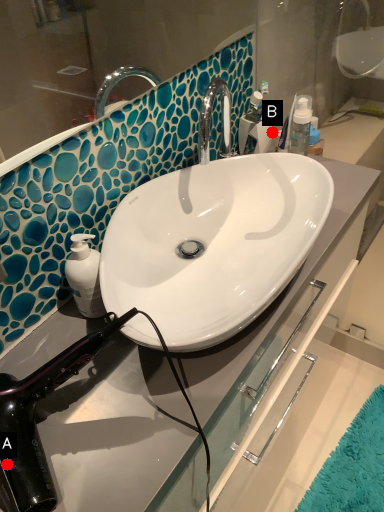
Question: Two points are circled on the image, labeled by A and B beside each circle. Which point appears closest to the camera in this image?

Choices:
 (A) A is closer
 (B) B is closer

Answer: (A)